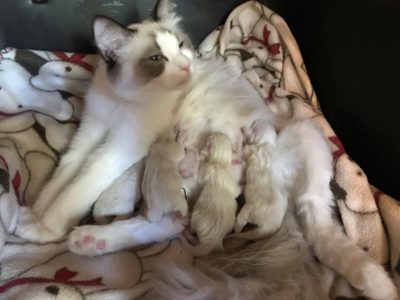
Where is `blanket`? The width and height of the screenshot is (400, 300). blanket is located at coordinates (62, 127).